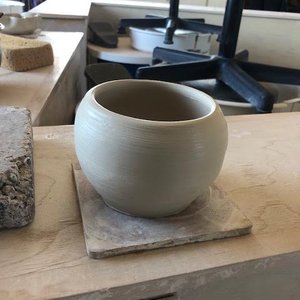
The width and height of the screenshot is (300, 300). Find the location of `marble`. marble is located at coordinates 112,243.